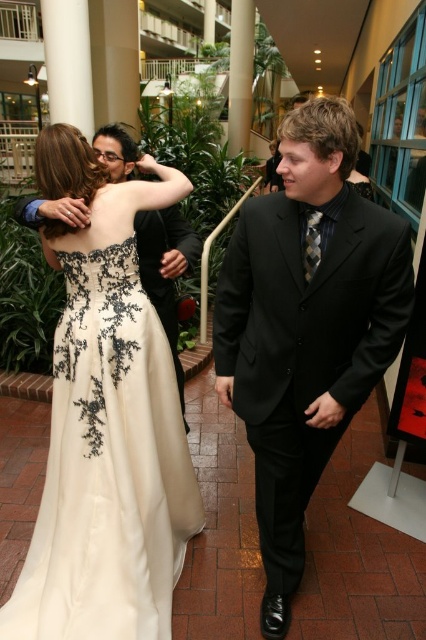
You are a photographer positioned at the camera. You want to capture a closeup shot of the ivory satin dress at upper left. Considering your current position, is the dress within a 1.5 meter reach for a handheld camera? Please explain.

The ivory satin dress at upper left is 1.69 meters from camera. Since 1.69 meters exceeds the 1.5 meter reach, the dress is slightly out of range for a handheld camera closeup without moving closer.

You are a photographer at this event and need to frame a shot that includes both the ivory satin dress at upper left and the black satin suit at center. Considering their sizes, which attire should you position closer to the edge of the frame to ensure both are fully visible?

The ivory satin dress at upper left is wider than the black satin suit at center. To ensure both are fully visible in the frame, position the ivory satin dress at upper left closer to the edge of the frame since it requires more space.